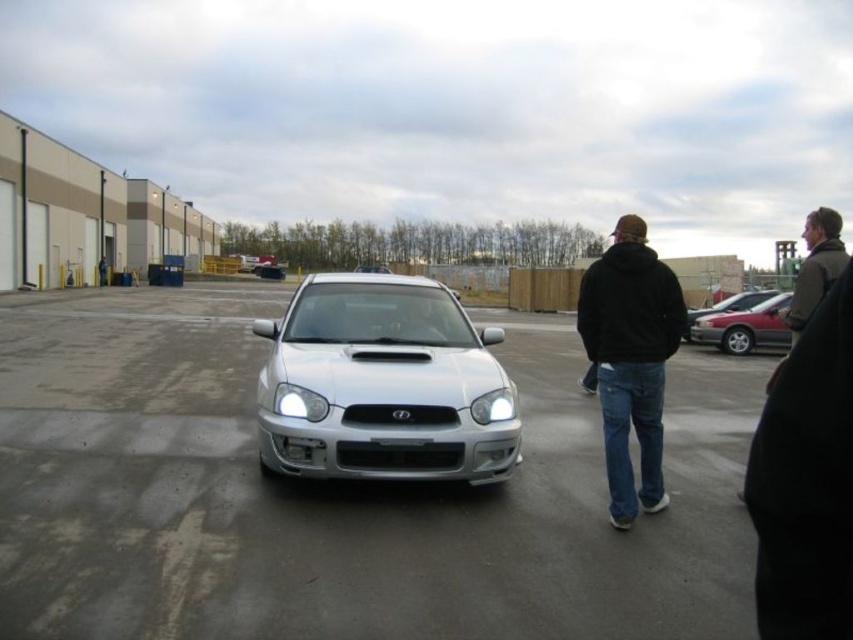
You are a photographer standing at the camera position. You want to take a photo of the metallic silver sedan at right. If your camera has a focal length of 50mm, what is the approximate distance you need to be from the sedan to capture it properly?

The metallic silver sedan at right is 15.62 meters away from the camera. To capture it properly with a 50mm focal length, you should maintain a distance of approximately 15.62 meters from the sedan.